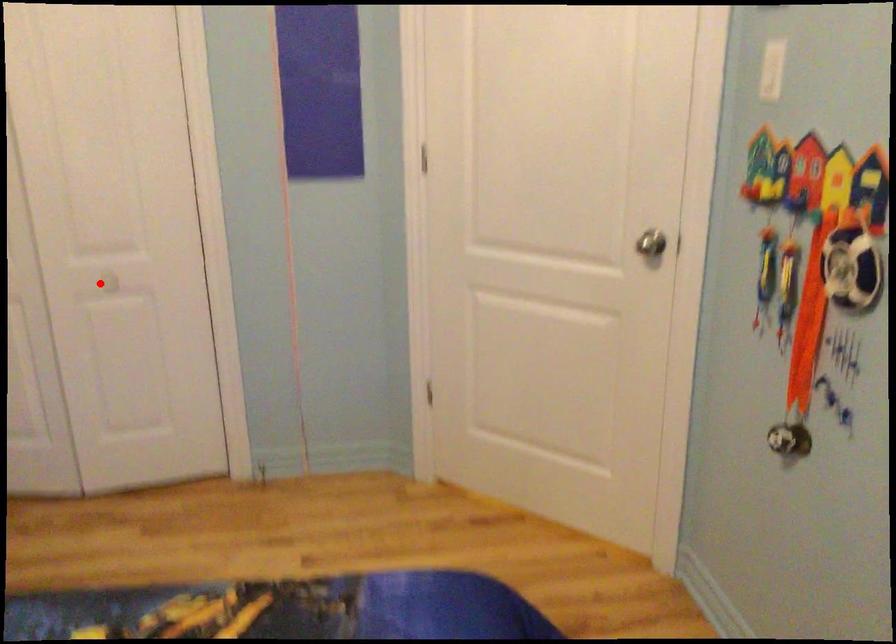
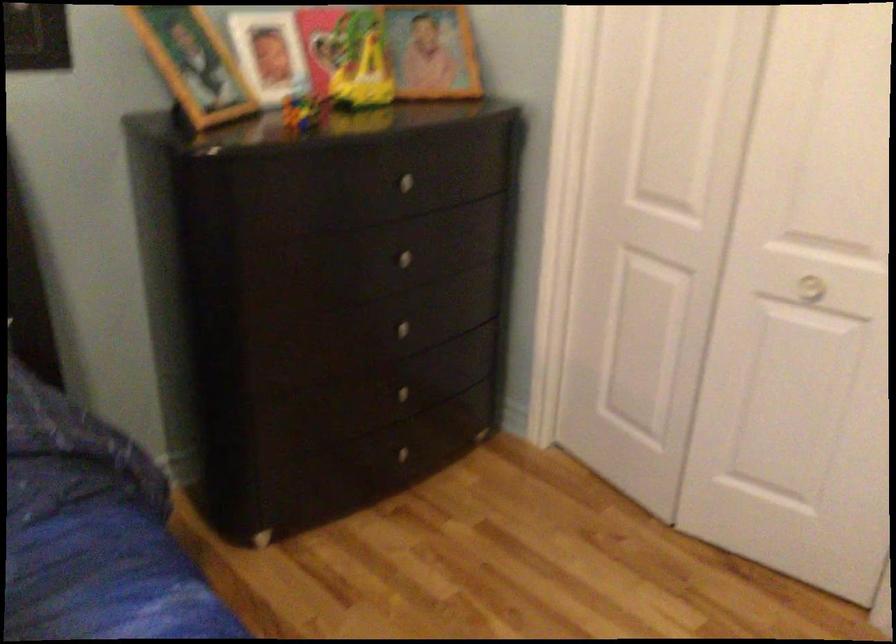
In the second image, find the point that corresponds to the highlighted location in the first image.

(810, 288)